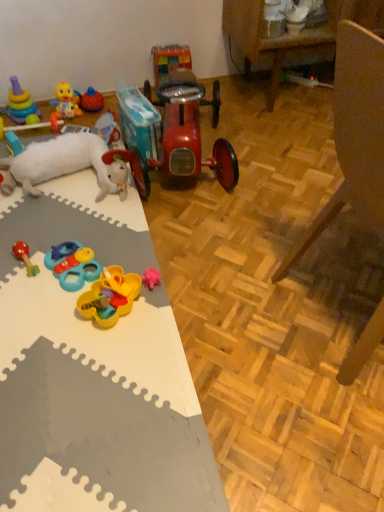
Identify the location of vacant region in front of rubber duck at upper left, the sixth toy viewed from the left. (93, 119).